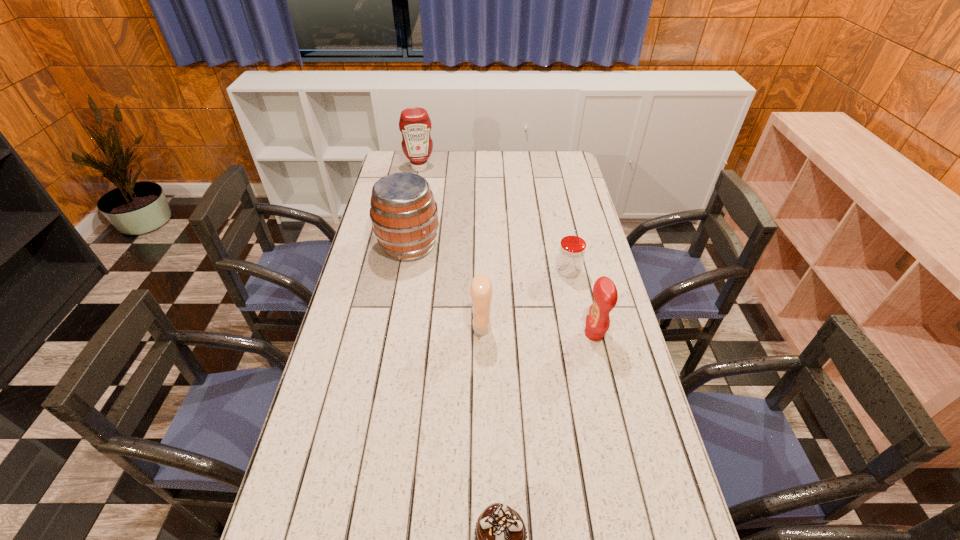
Identify the location of object positioned at the far left corner. This screenshot has width=960, height=540. (414, 123).

At what (x,y) coordinates should I click in order to perform the action: click on vacant region at the far edge of the desktop. Please return your answer as a coordinate pair (x, y). The height and width of the screenshot is (540, 960). Looking at the image, I should click on (534, 176).

You are a GUI agent. You are given a task and a screenshot of the screen. Output one action in this format:
    pyautogui.click(x=<x>, y=<y>)
    Task: Click on the free space at the left edge of the desktop
    Image resolution: width=960 pixels, height=540 pixels.
    Given the screenshot: What is the action you would take?
    pyautogui.click(x=371, y=260)

The image size is (960, 540). In the image, there is a desktop. Identify the location of vacant space at the right edge. (576, 285).

This screenshot has height=540, width=960. What are the coordinates of `blank space at the far left corner` in the screenshot? It's located at (400, 162).

This screenshot has width=960, height=540. What are the coordinates of `free space at the far right corner of the desktop` in the screenshot? It's located at pos(549,171).

I want to click on free space between the rightmost condiment and the cider, so click(x=501, y=290).

Image resolution: width=960 pixels, height=540 pixels. Find the location of `unoccupied position between the cider and the second condiment from right to left`. unoccupied position between the cider and the second condiment from right to left is located at coordinates (445, 287).

Locate an element on the screen. The width and height of the screenshot is (960, 540). free space between the rightmost condiment and the cider is located at coordinates (501, 290).

Identify the location of empty space that is in between the cider and the rightmost condiment. (501, 290).